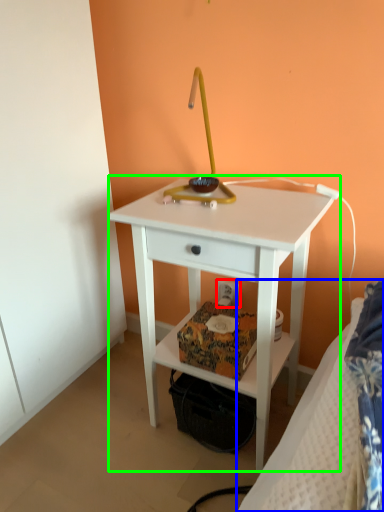
Question: Estimate the real-world distances between objects in this image. Which object is closer to electric outlet (highlighted by a red box), bed (highlighted by a blue box) or nightstand (highlighted by a green box)?

Choices:
 (A) bed
 (B) nightstand

Answer: (B)